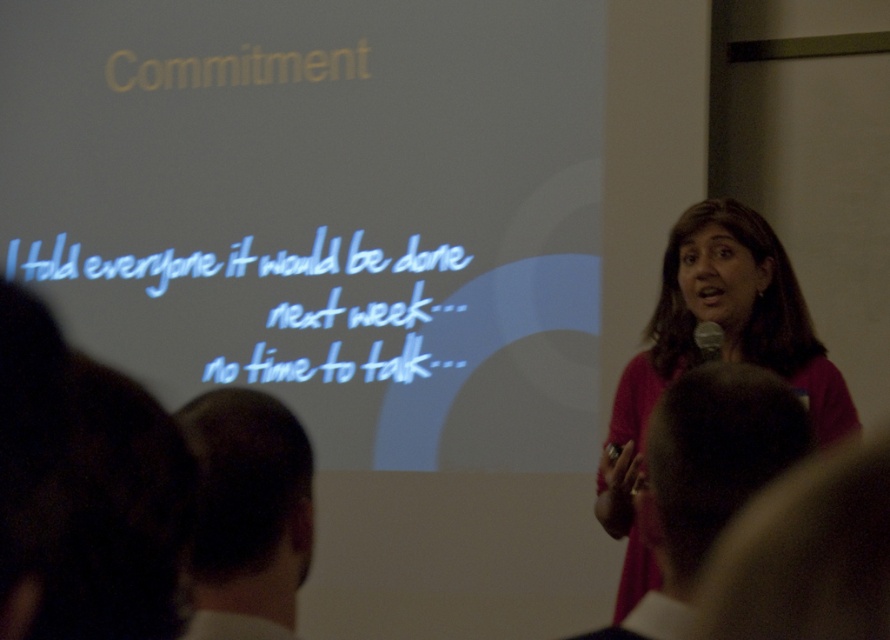
You are an event planner organizing a presentation. You want to ensure that the white matte projection screen at upper center and the white handwritten text at center are both visible to the audience. Considering their sizes, which object should you focus on adjusting to improve visibility for the audience?

The white matte projection screen at upper center is larger than the white handwritten text at center. To improve visibility, focus on adjusting the white handwritten text at center since it is smaller and might need to be made larger or highlighted more prominently.

Looking at this image, based on the scene, which object is smaller in size between the dark brown hair at lower left and the white handwritten text at center?

The dark brown hair at lower left is smaller in size compared to the white handwritten text at center.

You are an event planner setting up a conference room. You have a white matte projection screen at upper center and a matte pink shirt at right. Which object is taller?

The white matte projection screen at upper center is much taller than the matte pink shirt at right.